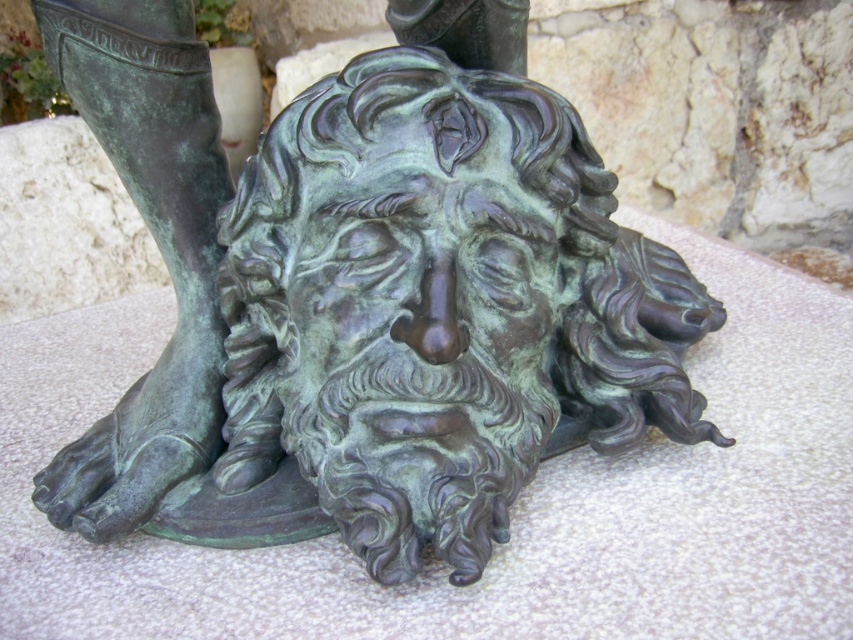
Based on the scene description, can you determine the spatial relationship between the green patina bronze face at center and the green patina boot at lower left?

The green patina bronze face at center is to the right of the green patina boot at lower left.

You are an art conservator assessing the sculpture. You notice the green patina bronze face at center and the green patina boot at lower left. Which object is larger in size?

The green patina boot at lower left is larger in size compared to the green patina bronze face at center.

You are an art conservator examining the bronze sculpture. You notice the green patina on both the green patina bronze face at center and the green patina boot at lower left. Based on their positions, which one is closer to the ground?

The green patina bronze face at center is closer to the ground because it is positioned below the green patina boot at lower left.